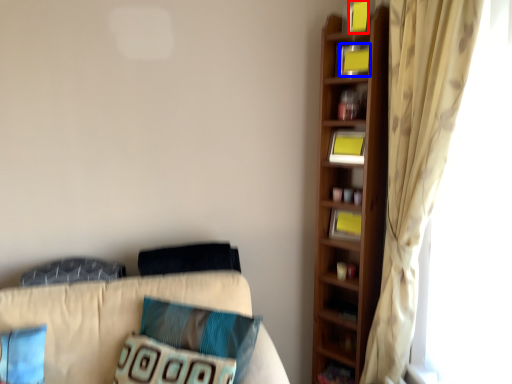
Question: Which of the following is the farthest to the observer, book (highlighted by a red box) or book (highlighted by a blue box)?

Choices:
 (A) book
 (B) book

Answer: (B)